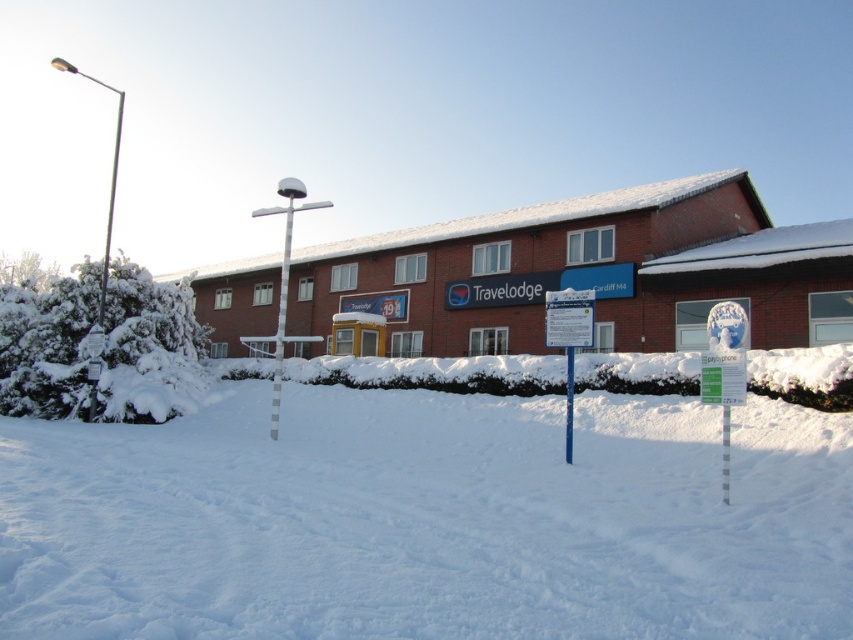
You are standing in front of the Travelodge hotel in Cardiff. You see the white fluffy snow at center and the white plastic pole at center. Which one is taller?

The white fluffy snow at center is taller than the white plastic pole at center.

You are standing in front of the Travelodge hotel in Cardiff M4. You see a point marked at coordinates (x=432, y=516). What is located at that point?

The point at coordinates (x=432, y=516) indicates white fluffy snow at center.